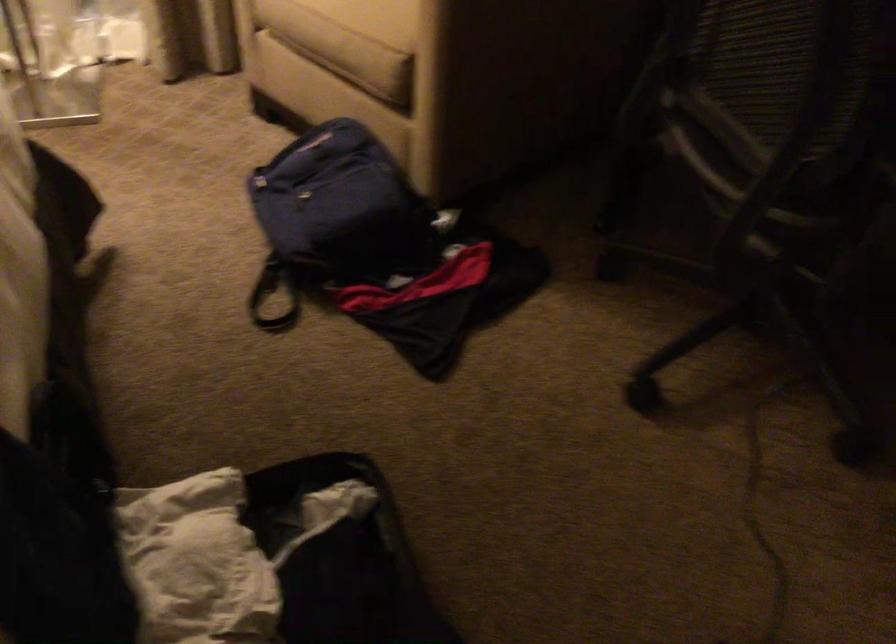
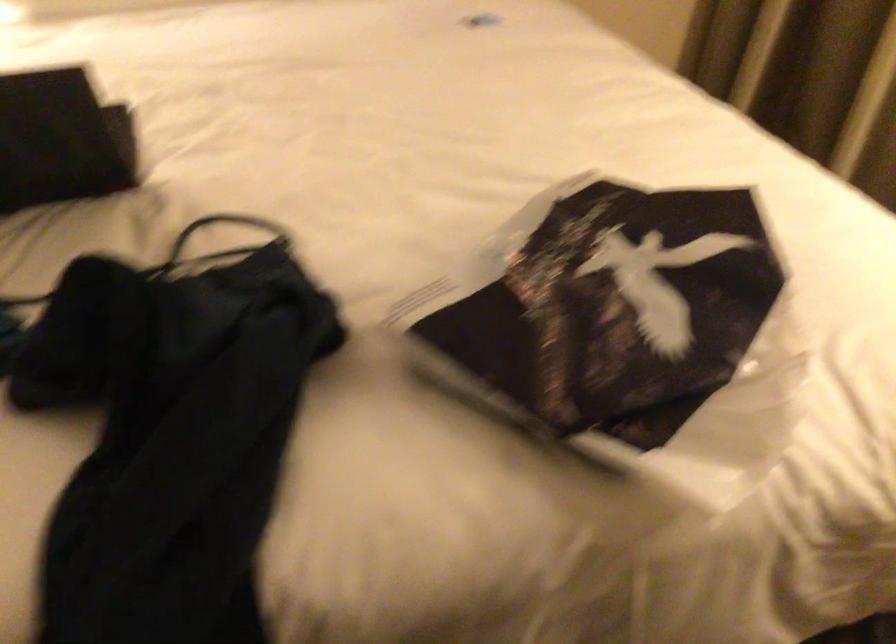
The first image is from the beginning of the video and the second image is from the end. How did the camera likely rotate when shooting the video?

The rotation direction of the camera is left-down.